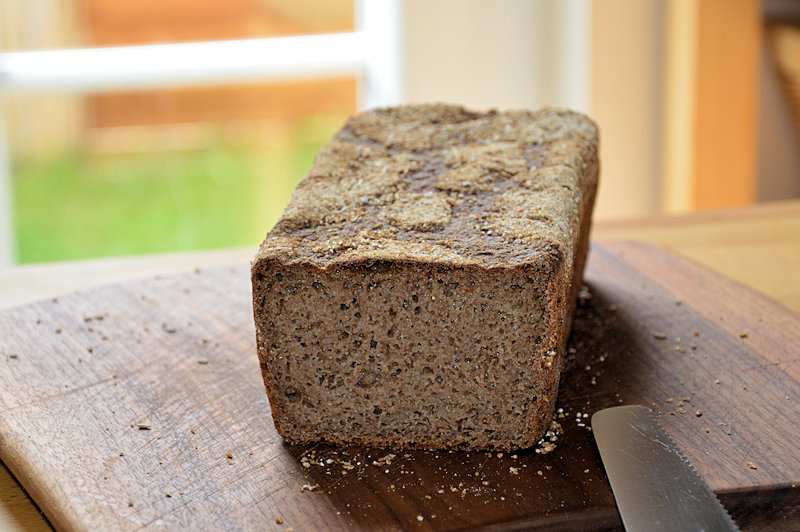
This screenshot has width=800, height=532. What are the coordinates of `table` in the screenshot? It's located at (766, 239).